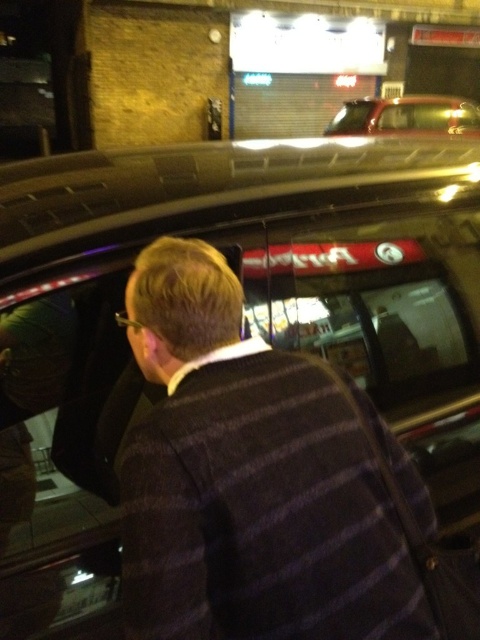
You are standing in front of the car in the image. There are two points marked on the car. The first point is at coordinate point (335, 573) and the second is at point (397, 97). Which of these points is closer to you?

Point (335, 573) is closer to the viewer than point (397, 97).

Looking at this image, you are a photographer trying to capture the scene of a person interacting with a car. Given that the dark striped sweater at center and the metallic gold car at upper center are both in the frame, which object should you focus on to ensure the larger subject is properly highlighted?

The metallic gold car at upper center should be focused on because it occupies more space than the dark striped sweater at center, making it the larger subject in the frame.

You are a photographer trying to capture the scene of a person interacting with a car. Based on the image, which object, the dark striped sweater at center or the metallic gold car at upper center, is positioned higher in the frame?

The metallic gold car at upper center is positioned higher in the frame than the dark striped sweater at center.